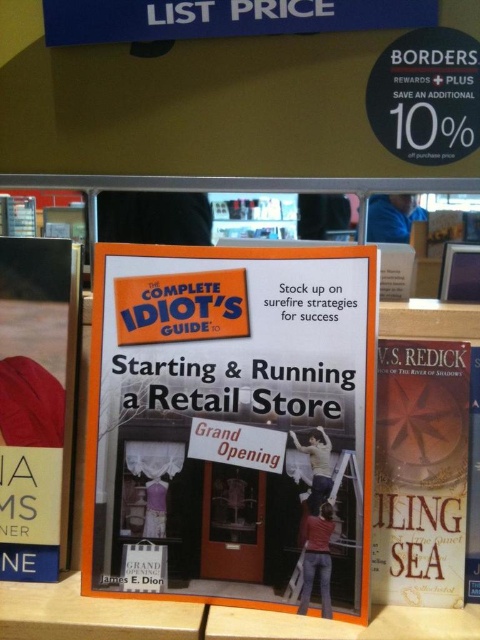
Question: Which point is closer to the camera taking this photo?

Choices:
 (A) (17, 422)
 (B) (245, 403)
 (C) (456, 440)
 (D) (474, 376)

Answer: (C)

Question: Among these objects, which one is farthest from the camera?

Choices:
 (A) hardcover book at right
 (B) hardcover book at center
 (C) hardcover book at left
 (D) orange matte book at center

Answer: (C)

Question: Which object is farther from the camera taking this photo?

Choices:
 (A) hardcover book at left
 (B) hardcover book at center

Answer: (A)

Question: Does hardcover book at left lie behind hardcover book at center?

Choices:
 (A) yes
 (B) no

Answer: (A)

Question: Can you confirm if orange matte book at center is wider than hardcover book at right?

Choices:
 (A) no
 (B) yes

Answer: (B)

Question: Can you confirm if hardcover book at left is wider than hardcover book at center?

Choices:
 (A) no
 (B) yes

Answer: (B)